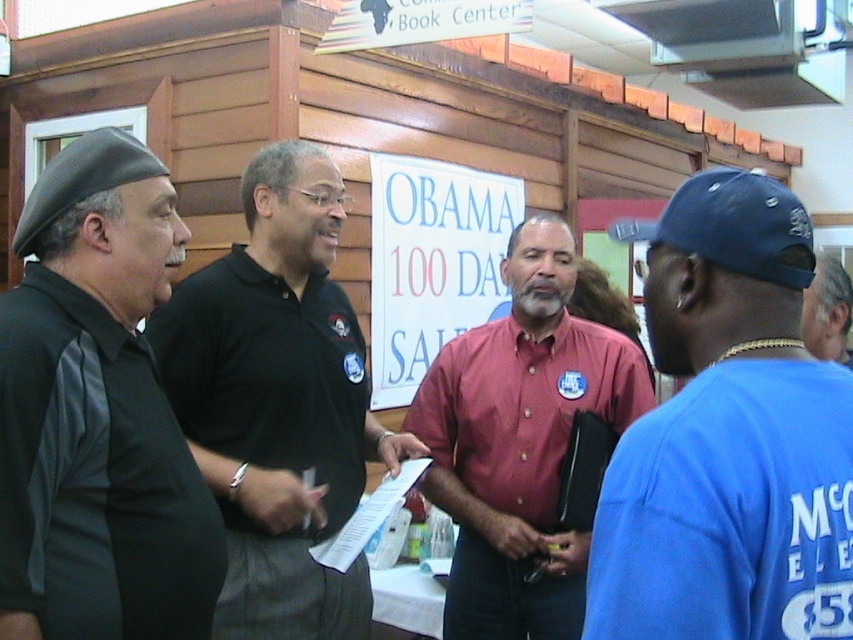
You are a photographer at the event and want to capture both the black matte beret at left and the blue fabric baseball cap at right in a single frame. Which object should you focus on first to ensure both are in the frame?

The black matte beret at left is larger in size than the blue fabric baseball cap at right, so you should focus on the black matte beret at left first to ensure both are captured in the frame.